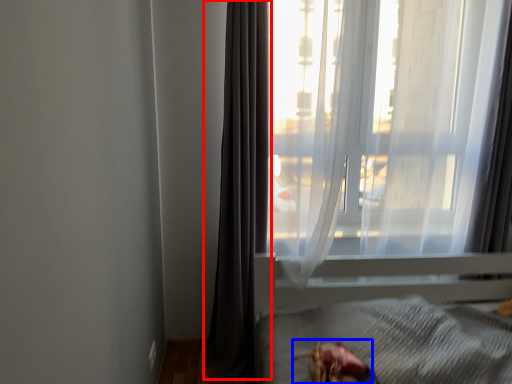
Question: Which object is further to the camera taking this photo, curtain (highlighted by a red box) or animal (highlighted by a blue box)?

Choices:
 (A) curtain
 (B) animal

Answer: (A)